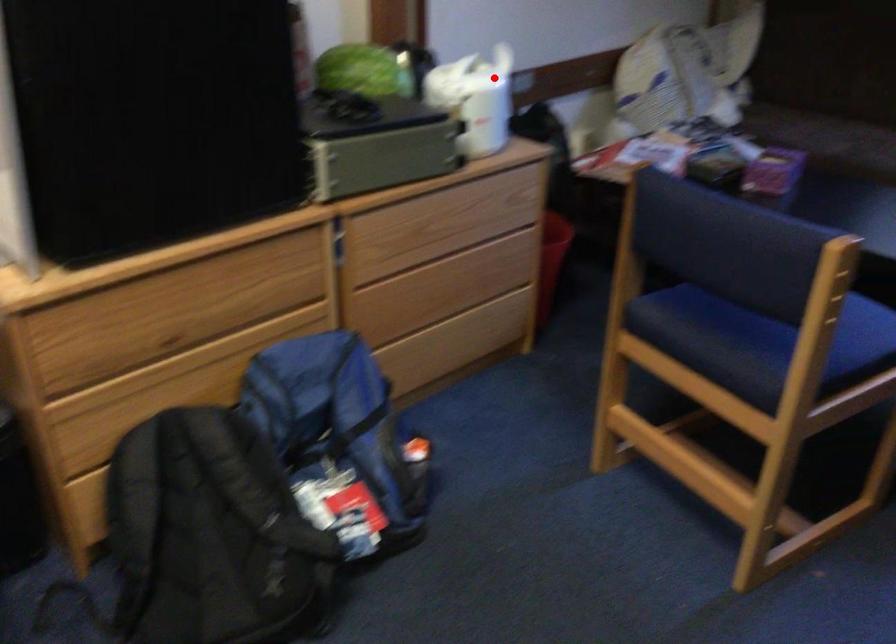
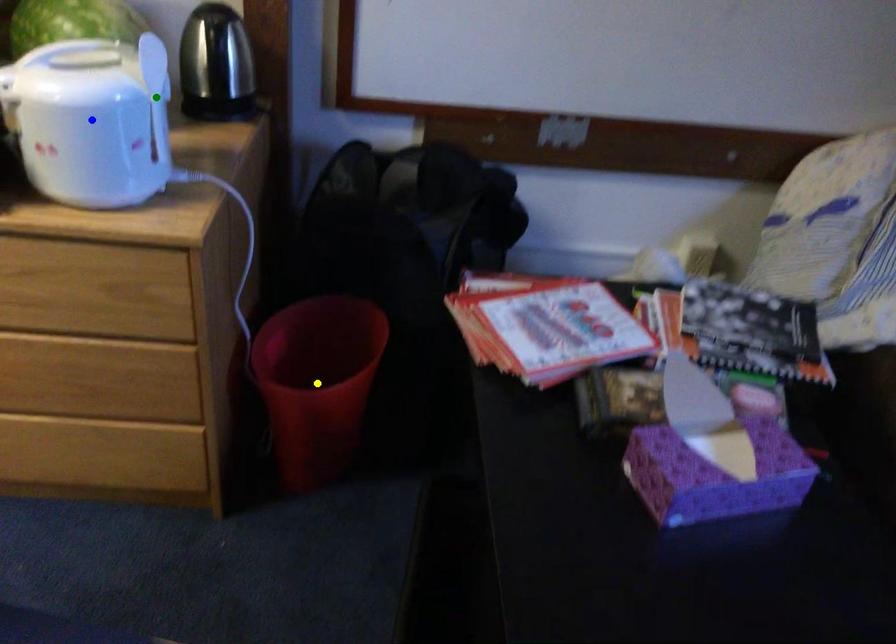
Question: I am providing you with two images of the same scene from different viewpoints. A red point is marked on the first image. You are given multiple points on the second image. Which point in image 2 is actually the same real-world point as the red point in image 1?

Choices:
 (A) blue point
 (B) green point
 (C) yellow point

Answer: (B)